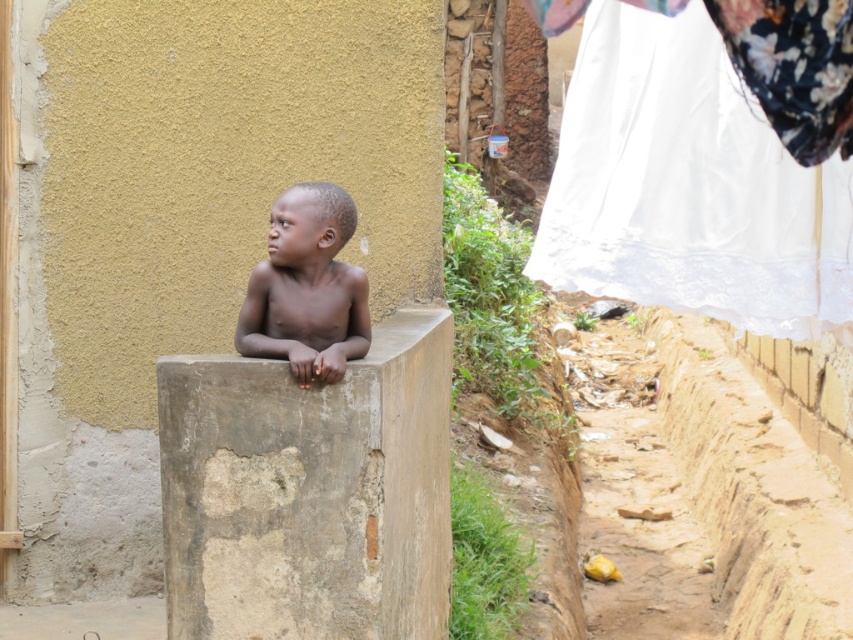
Question: Can you confirm if white lace fabric at upper right is positioned to the left of dark skin/smooth skin/boy at center?

Choices:
 (A) yes
 (B) no

Answer: (B)

Question: Which of these objects is positioned closest to the gray concrete wall at center?

Choices:
 (A) dark skin/smooth skin/boy at center
 (B) white lace fabric at upper right

Answer: (A)

Question: Which object is the farthest from the gray concrete wall at center?

Choices:
 (A) dark skin/smooth skin/boy at center
 (B) white lace fabric at upper right

Answer: (B)

Question: Is gray concrete wall at center below dark skin/smooth skin/boy at center?

Choices:
 (A) yes
 (B) no

Answer: (A)

Question: In this image, where is gray concrete wall at center located relative to dark skin/smooth skin/boy at center?

Choices:
 (A) below
 (B) above

Answer: (A)

Question: Among these objects, which one is farthest from the camera?

Choices:
 (A) gray concrete wall at center
 (B) white lace fabric at upper right
 (C) dark skin/smooth skin/boy at center

Answer: (A)